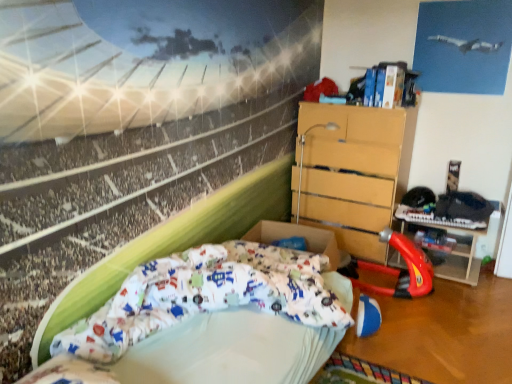
Question: Considering the positions of point (450, 273) and point (365, 137), is point (450, 273) closer or farther from the camera than point (365, 137)?

Choices:
 (A) farther
 (B) closer

Answer: (A)

Question: In terms of width, does rubberized plastic toy at lower right look wider or thinner when compared to wooden chest of drawers at center-right?

Choices:
 (A) wide
 (B) thin

Answer: (B)

Question: Estimate the real-world distances between objects in this image. Which object is farther from the white fabric bed at lower left?

Choices:
 (A) red plastic toy car at center right
 (B) rubberized plastic toy at lower right
 (C) wooden chest of drawers at center-right

Answer: (B)

Question: Which object is the farthest from the white fabric bed at lower left?

Choices:
 (A) red plastic toy car at center right
 (B) rubberized plastic toy at lower right
 (C) wooden chest of drawers at center-right

Answer: (B)